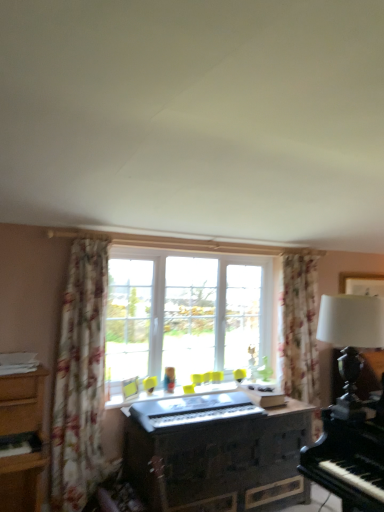
Question: Considering the relative sizes of floral fabric curtain at left and clear glass window at center in the image provided, is floral fabric curtain at left smaller than clear glass window at center?

Choices:
 (A) yes
 (B) no

Answer: (A)

Question: Is floral fabric curtain at left surrounding clear glass window at center?

Choices:
 (A) yes
 (B) no

Answer: (B)

Question: Can you confirm if floral fabric curtain at left is wider than clear glass window at center?

Choices:
 (A) no
 (B) yes

Answer: (A)

Question: From a real-world perspective, is floral fabric curtain at left on clear glass window at center?

Choices:
 (A) no
 (B) yes

Answer: (A)

Question: Does floral fabric curtain at left lie in front of clear glass window at center?

Choices:
 (A) yes
 (B) no

Answer: (A)

Question: Considering the relative sizes of floral fabric curtain at left and clear glass window at center in the image provided, is floral fabric curtain at left bigger than clear glass window at center?

Choices:
 (A) no
 (B) yes

Answer: (A)

Question: Is wooden dresser at center bigger than floral fabric curtain at left?

Choices:
 (A) yes
 (B) no

Answer: (A)

Question: Is wooden dresser at center oriented away from floral fabric curtain at left?

Choices:
 (A) no
 (B) yes

Answer: (A)

Question: Is wooden dresser at center completely or partially outside of floral fabric curtain at left?

Choices:
 (A) no
 (B) yes

Answer: (B)

Question: Does wooden dresser at center have a lesser width compared to floral fabric curtain at left?

Choices:
 (A) no
 (B) yes

Answer: (A)

Question: Is wooden dresser at center facing towards floral fabric curtain at left?

Choices:
 (A) yes
 (B) no

Answer: (B)

Question: Considering the relative sizes of wooden dresser at center and floral fabric curtain at left in the image provided, is wooden dresser at center shorter than floral fabric curtain at left?

Choices:
 (A) no
 (B) yes

Answer: (B)

Question: Is white matte table lamp at right located outside floral fabric curtain at left?

Choices:
 (A) yes
 (B) no

Answer: (A)